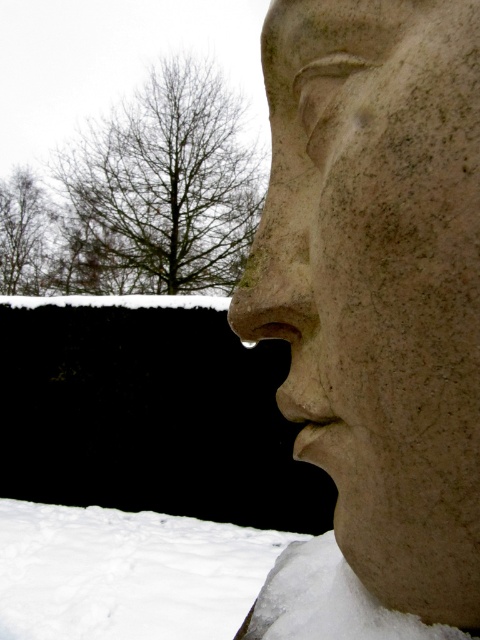
You are standing in front of the sculpture and want to place a small decorative snowflake exactly at the base of the granite statue at center. According to the coordinates provided, where should you place the snowflake?

The granite statue at center is located at point coordinates (379, 282), so you should place the snowflake at the base of the granite statue at center at those coordinates.

You are an art conservator assessing the stone sculpture. You notice the rough stone nose at center and the brown leafless tree at upper left. Which object is positioned higher in the image?

The brown leafless tree at upper left is positioned higher than the rough stone nose at center.